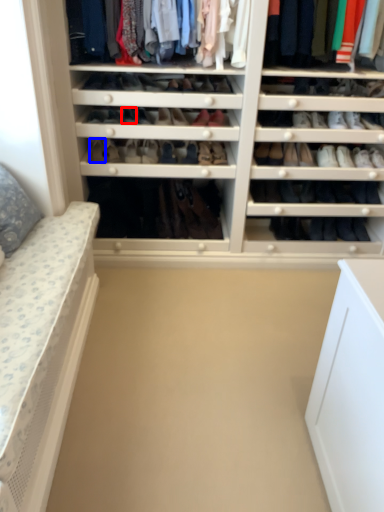
Question: Which object is closer to the camera taking this photo, shoe (highlighted by a red box) or shoe (highlighted by a blue box)?

Choices:
 (A) shoe
 (B) shoe

Answer: (A)